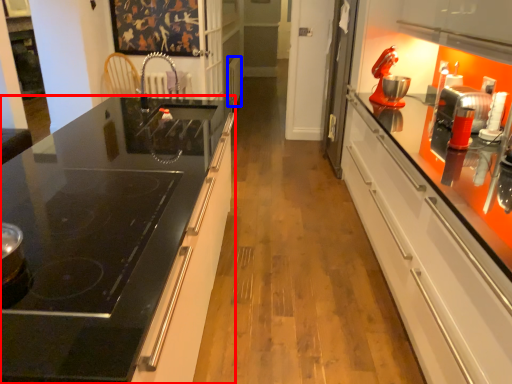
Question: Among these objects, which one is nearest to the camera, countertop (highlighted by a red box) or appliance (highlighted by a blue box)?

Choices:
 (A) countertop
 (B) appliance

Answer: (A)